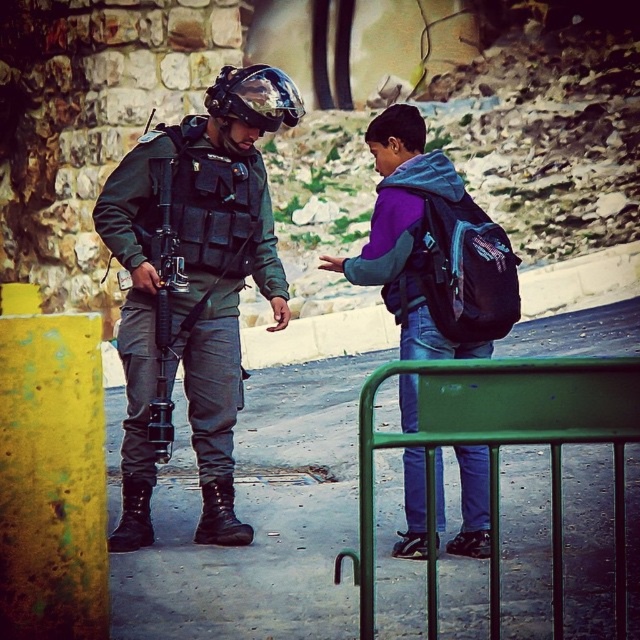
Does purple fleece jacket at center come in front of matte black backpack at center right?

No, purple fleece jacket at center is further to the viewer.

Is point (396, 188) positioned before point (461, 205)?

Yes, it is in front of point (461, 205).

Locate an element on the screen. The image size is (640, 640). purple fleece jacket at center is located at coordinates (422, 244).

Who is taller, matte black backpack at center right or matte black helmet at center?

matte black backpack at center right is taller.

Image resolution: width=640 pixels, height=640 pixels. Find the location of `matte black backpack at center right`. matte black backpack at center right is located at coordinates (468, 269).

At what (x,y) coordinates should I click in order to perform the action: click on matte black backpack at center right. Please return your answer as a coordinate pair (x, y). The image size is (640, 640). Looking at the image, I should click on (468, 269).

Who is positioned more to the left, matte black uniform at center or matte black helmet at center?

matte black uniform at center

Is point (241, 285) closer to viewer compared to point (298, 102)?

No, (241, 285) is behind (298, 102).

Describe the element at coordinates (193, 285) in the screenshot. I see `matte black uniform at center` at that location.

Where is `matte black uniform at center`? matte black uniform at center is located at coordinates (193, 285).